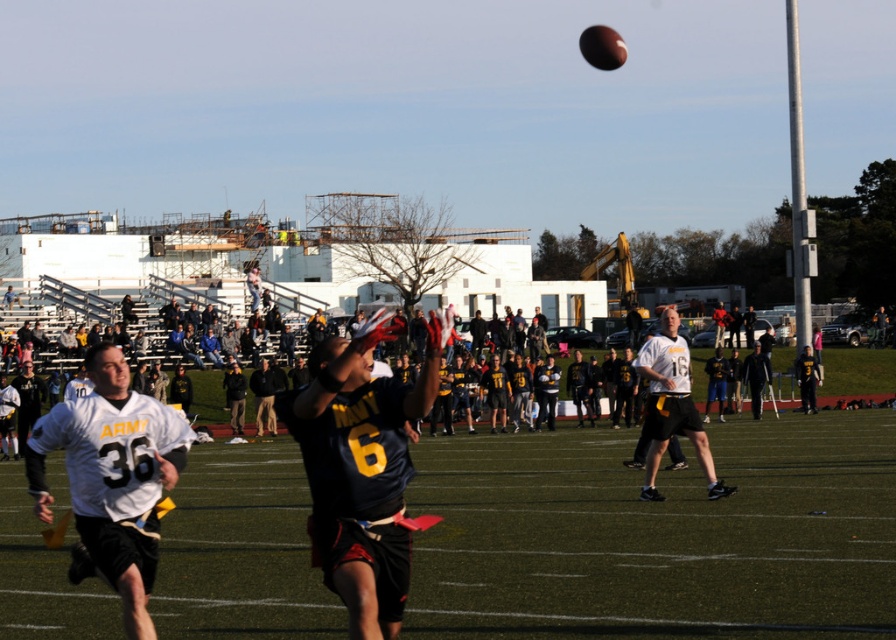
Is white jersey at center wider than white matte jersey at center?

No, white jersey at center is not wider than white matte jersey at center.

Which is behind, point (89, 378) or point (703, 461)?

Positioned behind is point (703, 461).

Locate an element on the screen. white jersey at center is located at coordinates (113, 476).

Between dark blue jersey at center and white matte jersey at center, which one has less height?

Standing shorter between the two is dark blue jersey at center.

Is dark blue jersey at center shorter than white matte jersey at center?

Correct, dark blue jersey at center is not as tall as white matte jersey at center.

Does point (381, 584) lie in front of point (650, 412)?

Yes.

You are a GUI agent. You are given a task and a screenshot of the screen. Output one action in this format:
    pyautogui.click(x=<x>, y=<y>)
    Task: Click on the dark blue jersey at center
    
    Given the screenshot: What is the action you would take?
    pyautogui.click(x=360, y=472)

Can you confirm if dark blue jersey at center is positioned to the left of white jersey at center?

Incorrect, dark blue jersey at center is not on the left side of white jersey at center.

Who is positioned more to the right, dark blue jersey at center or white jersey at center?

From the viewer's perspective, dark blue jersey at center appears more on the right side.

Does point (393, 465) come behind point (136, 552)?

No, (393, 465) is closer to viewer.

Identify the location of dark blue jersey at center. (360, 472).